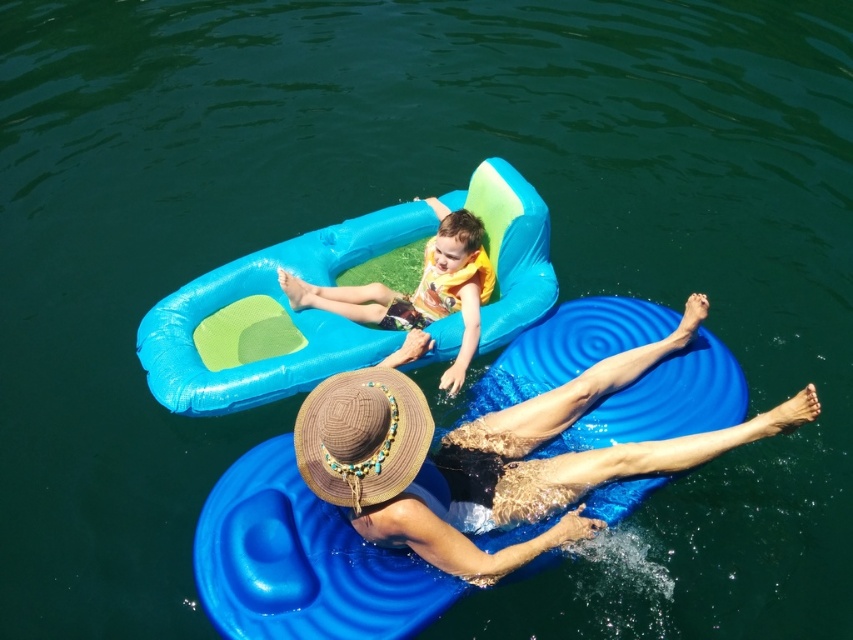
Does straw hat at lower center have a greater width compared to blue inflatable boat at upper center?

Incorrect, straw hat at lower center's width does not surpass blue inflatable boat at upper center's.

Between straw hat at lower center and blue inflatable boat at upper center, which one appears on the left side from the viewer's perspective?

Positioned to the left is blue inflatable boat at upper center.

Between point (769, 435) and point (440, 323), which one is positioned behind?

The point (440, 323) is more distant.

Locate an element on the screen. This screenshot has width=853, height=640. straw hat at lower center is located at coordinates (495, 456).

Between straw hat at lower center and matte yellow life vest at center, which one has more height?

With more height is straw hat at lower center.

How much distance is there between straw hat at lower center and matte yellow life vest at center?

A distance of 35.30 inches exists between straw hat at lower center and matte yellow life vest at center.

Locate an element on the screen. The height and width of the screenshot is (640, 853). straw hat at lower center is located at coordinates (495, 456).

Between blue inflatable boat at upper center and matte yellow life vest at center, which one has less height?

With less height is matte yellow life vest at center.

Can you confirm if blue inflatable boat at upper center is bigger than matte yellow life vest at center?

Yes, blue inflatable boat at upper center is bigger than matte yellow life vest at center.

Who is more forward, (184, 365) or (403, 324)?

Point (184, 365)

This screenshot has width=853, height=640. Identify the location of blue inflatable boat at upper center. pyautogui.click(x=268, y=320).